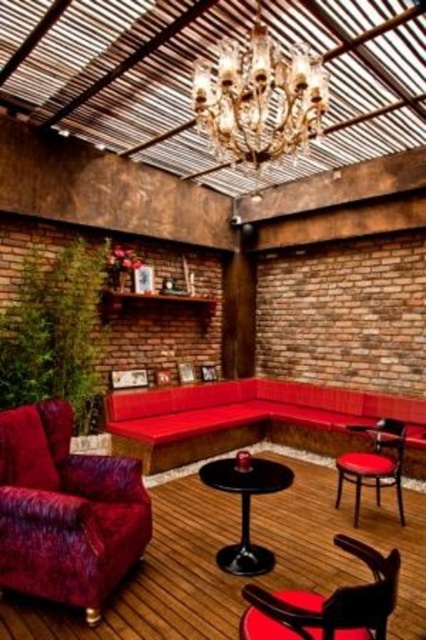
Question: Does velvet red couch at center come in front of shiny black table at center?

Choices:
 (A) yes
 (B) no

Answer: (B)

Question: Can you confirm if velvet red couch at center is bigger than matte black chair at lower right?

Choices:
 (A) no
 (B) yes

Answer: (B)

Question: Which point is farther from the camera taking this photo?

Choices:
 (A) (348, 429)
 (B) (342, 618)
 (C) (247, 484)
 (D) (308, 67)

Answer: (A)

Question: Which point is closer to the camera?

Choices:
 (A) tap(270, 484)
 (B) tap(382, 460)
 (C) tap(118, 442)

Answer: (A)

Question: Is velvet red couch at center smaller than crystal glass chandelier at upper center?

Choices:
 (A) yes
 (B) no

Answer: (B)

Question: Which is farther from the velvet red couch at center?

Choices:
 (A) matte black chair at lower right
 (B) matte black armchair at lower right
 (C) crystal glass chandelier at upper center
 (D) shiny black table at center

Answer: (A)